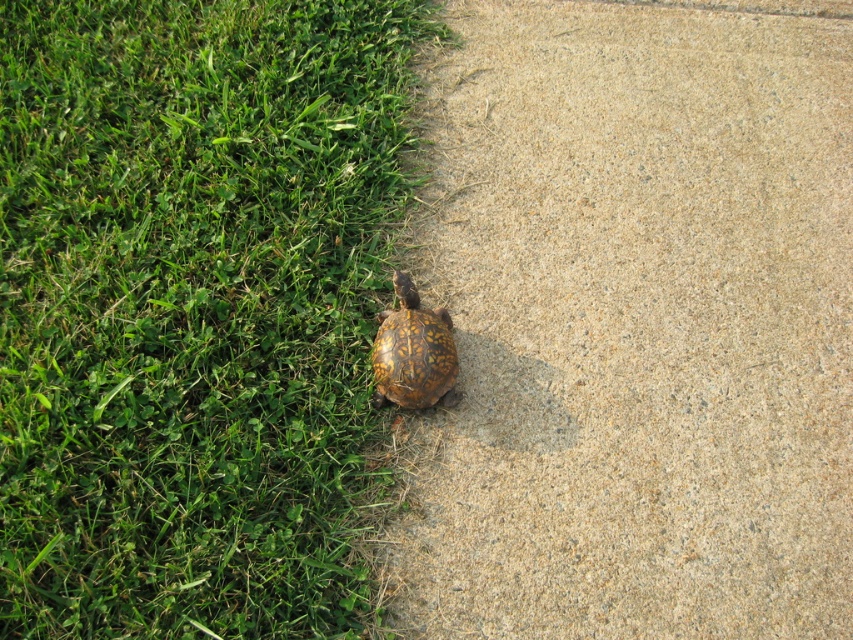
Question: Is green grass at lower left thinner than brown textured shell at lower center?

Choices:
 (A) yes
 (B) no

Answer: (B)

Question: Estimate the real-world distances between objects in this image. Which object is farther from the brown textured pavement at lower left?

Choices:
 (A) brown textured shell at lower center
 (B) green grass at lower left

Answer: (B)

Question: Is brown textured pavement at lower left above brown textured shell at lower center?

Choices:
 (A) yes
 (B) no

Answer: (A)

Question: Which point appears closest to the camera in this image?

Choices:
 (A) (704, 26)
 (B) (398, 364)
 (C) (10, 97)

Answer: (B)

Question: Can you confirm if brown textured pavement at lower left is positioned above brown textured shell at lower center?

Choices:
 (A) no
 (B) yes

Answer: (B)

Question: Which of the following is the closest to the observer?

Choices:
 (A) brown textured shell at lower center
 (B) green grass at lower left
 (C) brown textured pavement at lower left

Answer: (B)